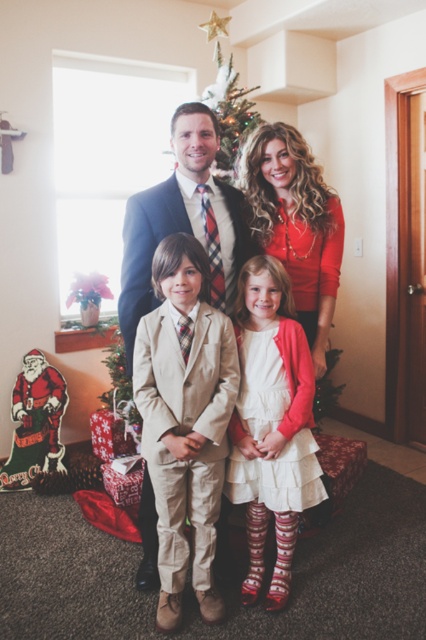
Question: Where is white satin dress at center located in relation to matte red sweater at center in the image?

Choices:
 (A) below
 (B) above

Answer: (A)

Question: Considering the real-world distances, which object is farthest from the matte red sweater at center?

Choices:
 (A) white satin dress at center
 (B) green matte christmas tree at center

Answer: (B)

Question: Can you confirm if white satin dress at center is smaller than light brown suit at center?

Choices:
 (A) no
 (B) yes

Answer: (B)

Question: Can you confirm if matte red sweater at center is wider than green matte christmas tree at center?

Choices:
 (A) yes
 (B) no

Answer: (A)

Question: Which point appears closest to the camera in this image?

Choices:
 (A) (293, 140)
 (B) (245, 595)
 (C) (213, 211)
 (D) (238, 147)

Answer: (B)

Question: Considering the real-world distances, which object is farthest from the white satin dress at center?

Choices:
 (A) light brown suit at center
 (B) matte red sweater at center
 (C) green matte christmas tree at center

Answer: (C)